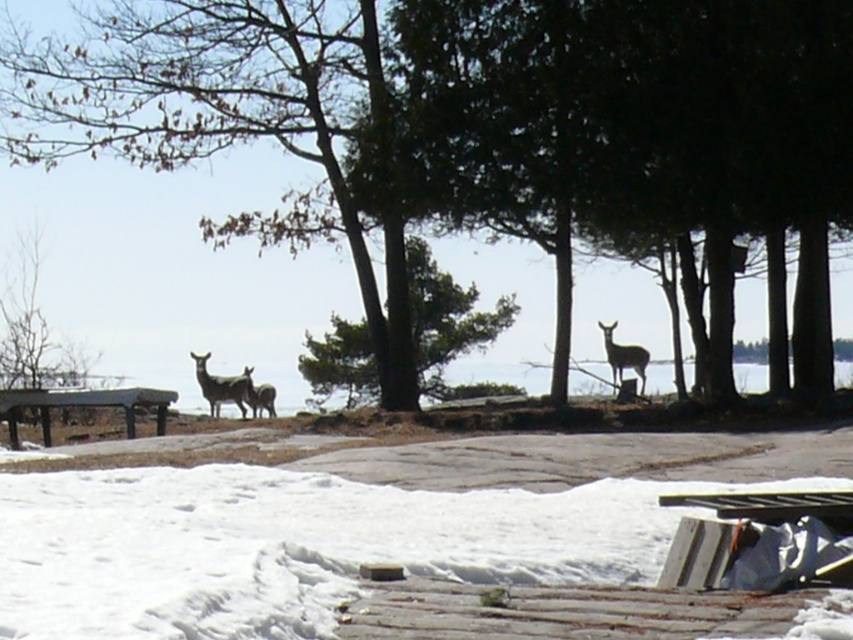
Which is above, green textured tree at center or brown fur deer at center?

Positioned higher is green textured tree at center.

Looking at this image, who is positioned more to the right, green textured tree at center or brown fur deer at center?

From the viewer's perspective, green textured tree at center appears more on the right side.

Does point (434, 394) lie behind point (235, 388)?

Yes.

Identify the location of green textured tree at center. (445, 317).

This screenshot has height=640, width=853. What do you see at coordinates (222, 387) in the screenshot? I see `brown fur deer at center` at bounding box center [222, 387].

The height and width of the screenshot is (640, 853). Describe the element at coordinates (222, 387) in the screenshot. I see `brown fur deer at center` at that location.

At what (x,y) coordinates should I click in order to perform the action: click on brown fur deer at center. Please return your answer as a coordinate pair (x, y). This screenshot has width=853, height=640. Looking at the image, I should click on (222, 387).

Is green leafy tree at center smaller than wooden picnic table at lower left?

No.

Between green leafy tree at center and wooden picnic table at lower left, which one is positioned lower?

Positioned lower is wooden picnic table at lower left.

Image resolution: width=853 pixels, height=640 pixels. Identify the location of green leafy tree at center. (245, 132).